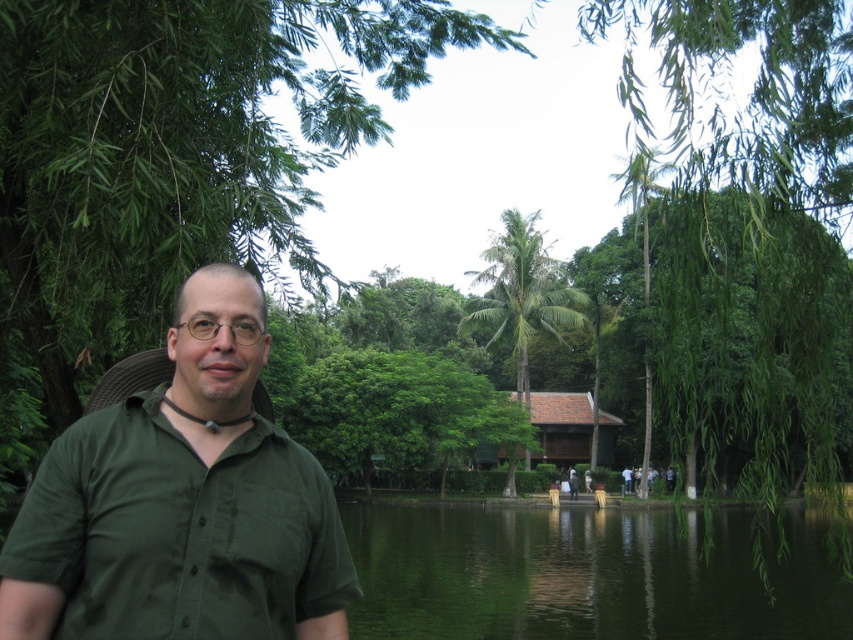
You are a photographer trying to capture the man in the green matte shirt at center. The green leafy palm tree at center is blocking your view. Can you move the tree to get a clear shot of the shirt?

The green leafy palm tree at center is positioned above the green matte shirt at center, so you cannot move the tree since it is part of the scene. However, you can adjust your angle or position to avoid the obstruction caused by the green leafy palm tree at center.

You are a photographer trying to capture a photo of the green matte shirt at center. The camera you are using has a focal length of 50mm and an aperture of f2.8. The shirt is located at point coordinates of 0.789 on the x axis and 0.215 on the y axis. To ensure the shirt is in focus, what adjustment should you make to the camera settings?

The green matte shirt at center is positioned at coordinates 0.789 on the x axis and 0.215 on the y axis. To ensure it is in focus, adjust the camera focus point to match these coordinates, keeping the focal length at 50mm and aperture at f2.8.

You are a photographer standing in the park. You want to take a photo of the green leafy tree at upper left and the green matte shirt at center. Which object is closer to you?

The green leafy tree at upper left is positioned over the green matte shirt at center, meaning it is closer to you.